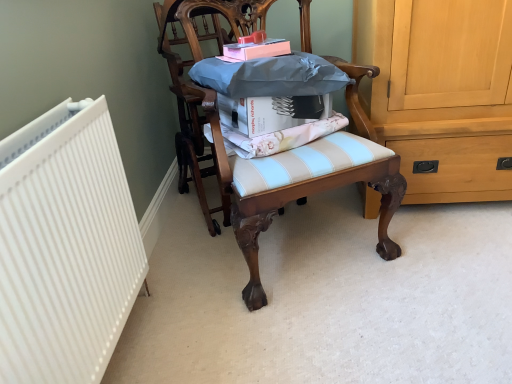
Question: From the image's perspective, is white matte book at center, positioned as the 1th book in bottom-to-top order, under pink matte book at upper center, the 1th book in the top-to-bottom sequence?

Choices:
 (A) no
 (B) yes

Answer: (B)

Question: Is white matte book at center, acting as the second book starting from the top, behind pink matte book at upper center, the 1th book in the top-to-bottom sequence?

Choices:
 (A) yes
 (B) no

Answer: (B)

Question: Is white matte book at center, positioned as the 1th book in bottom-to-top order, at the right side of pink matte book at upper center, the 1th book in the top-to-bottom sequence?

Choices:
 (A) no
 (B) yes

Answer: (B)

Question: Considering the relative sizes of white matte book at center, positioned as the 1th book in bottom-to-top order, and pink matte book at upper center, marked as the 2th book in a bottom-to-top arrangement, in the image provided, is white matte book at center, positioned as the 1th book in bottom-to-top order, taller than pink matte book at upper center, marked as the 2th book in a bottom-to-top arrangement,?

Choices:
 (A) yes
 (B) no

Answer: (A)

Question: Is pink matte book at upper center, the 1th book in the top-to-bottom sequence, at the back of white matte book at center, acting as the second book starting from the top?

Choices:
 (A) no
 (B) yes

Answer: (A)

Question: Is pink matte book at upper center, the 1th book in the top-to-bottom sequence, wider or thinner than light blue striped cushion at center?

Choices:
 (A) thin
 (B) wide

Answer: (A)

Question: Considering their positions, is pink matte book at upper center, the 1th book in the top-to-bottom sequence, located in front of or behind light blue striped cushion at center?

Choices:
 (A) front
 (B) behind

Answer: (B)

Question: Is pink matte book at upper center, the 1th book in the top-to-bottom sequence, inside or outside of light blue striped cushion at center?

Choices:
 (A) outside
 (B) inside

Answer: (A)

Question: From a real-world perspective, is pink matte book at upper center, the 1th book in the top-to-bottom sequence, positioned above or below light blue striped cushion at center?

Choices:
 (A) below
 (B) above

Answer: (B)

Question: Is wooden chair at center, which ranks as the 2th chair in right-to-left order, in front of or behind white matte book at center, positioned as the 1th book in bottom-to-top order, in the image?

Choices:
 (A) behind
 (B) front

Answer: (A)

Question: Is point (181, 145) closer or farther from the camera than point (275, 105)?

Choices:
 (A) farther
 (B) closer

Answer: (A)

Question: In terms of height, does wooden chair at center, placed as the first chair when sorted from left to right, look taller or shorter compared to white matte book at center, acting as the second book starting from the top?

Choices:
 (A) short
 (B) tall

Answer: (B)

Question: Considering the relative positions of wooden chair at center, which ranks as the 2th chair in right-to-left order, and white matte book at center, positioned as the 1th book in bottom-to-top order, in the image provided, is wooden chair at center, which ranks as the 2th chair in right-to-left order, to the left or to the right of white matte book at center, positioned as the 1th book in bottom-to-top order,?

Choices:
 (A) left
 (B) right

Answer: (A)

Question: Considering the positions of wooden chair at center, which is the 2th chair from left to right, and wooden chair at center, which ranks as the 2th chair in right-to-left order, in the image, is wooden chair at center, which is the 2th chair from left to right, wider or thinner than wooden chair at center, which ranks as the 2th chair in right-to-left order,?

Choices:
 (A) wide
 (B) thin

Answer: (A)

Question: Is wooden chair at center, which is the 2th chair from left to right, bigger or smaller than wooden chair at center, placed as the first chair when sorted from left to right?

Choices:
 (A) small
 (B) big

Answer: (B)